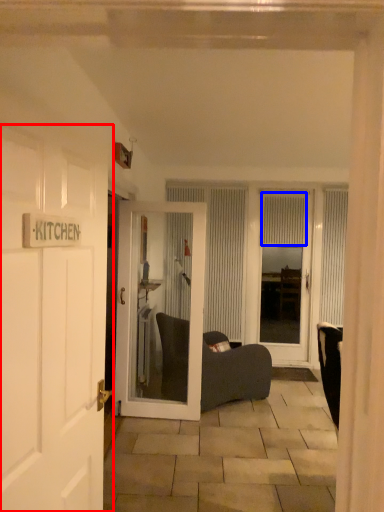
Question: Among these objects, which one is nearest to the camera, door (highlighted by a red box) or curtain (highlighted by a blue box)?

Choices:
 (A) door
 (B) curtain

Answer: (A)